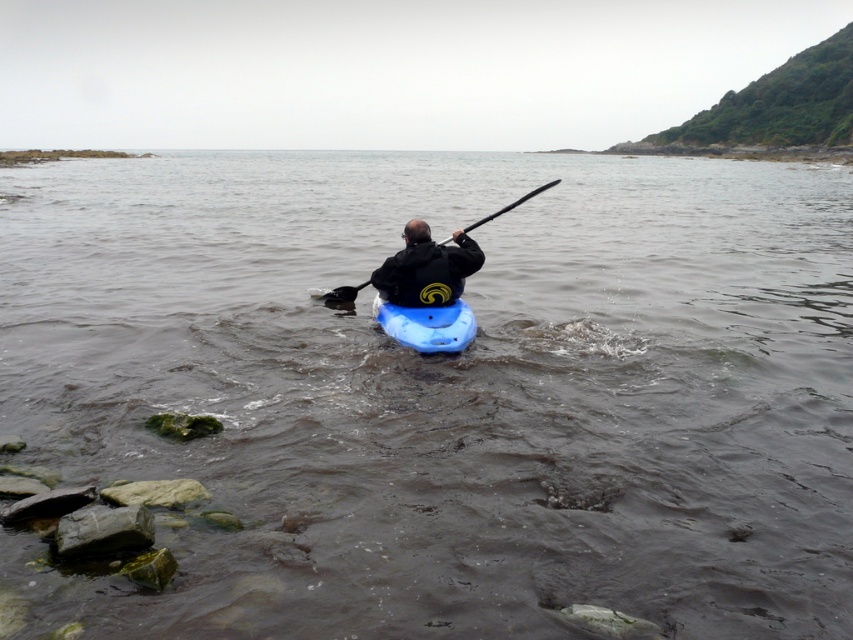
Question: Does black matte jacket at center have a greater width compared to black plastic paddle at center?

Choices:
 (A) yes
 (B) no

Answer: (B)

Question: Which point appears closest to the camera in this image?

Choices:
 (A) (451, 252)
 (B) (457, 307)
 (C) (328, 291)

Answer: (A)

Question: Is blue matte kayak at center thinner than black plastic paddle at center?

Choices:
 (A) no
 (B) yes

Answer: (B)

Question: Among these objects, which one is farthest from the camera?

Choices:
 (A) blue matte kayak at center
 (B) black plastic paddle at center
 (C) black matte jacket at center

Answer: (B)

Question: Which point is closer to the camera?

Choices:
 (A) (376, 316)
 (B) (358, 285)
 (C) (432, 275)

Answer: (C)

Question: Can you confirm if blue matte kayak at center is wider than black plastic paddle at center?

Choices:
 (A) yes
 (B) no

Answer: (B)